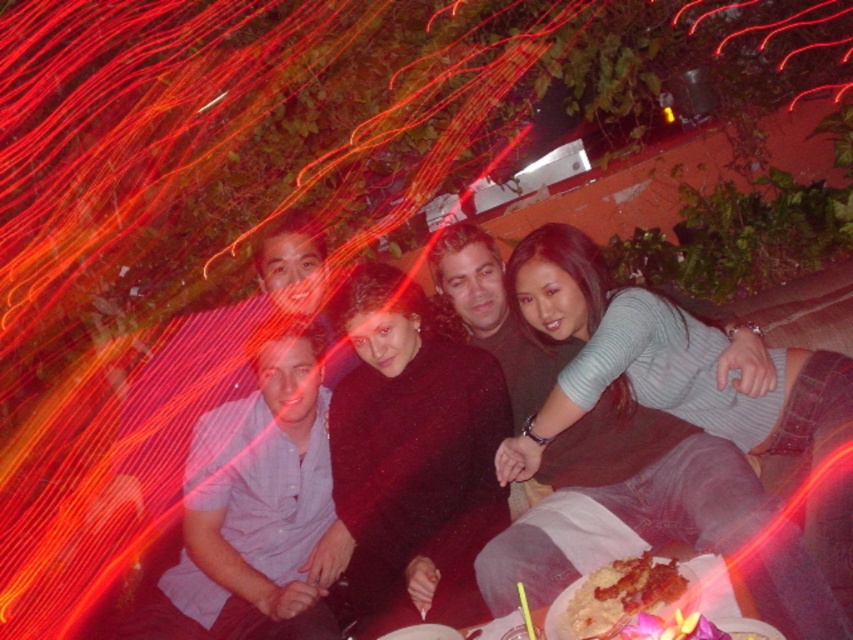
You are a photographer trying to capture a closeup shot of the golden crispy chicken at lower center without including the light blue sweater at center in the frame. Based on their positions, is it possible to do so?

The light blue sweater at center is to the right of golden crispy chicken at lower center. Since the sweater is positioned to the right of the chicken, you can adjust your camera angle to focus solely on the golden crispy chicken at lower center by moving your camera slightly to the left, away from the sweater.

You are taking a photo of the group and want to focus on the person at point (593, 260) and the person at point (633, 568). Which of these two points is closer to the camera?

Point (593, 260) is further to the camera than point (633, 568), so the point (633, 568) is closer to the camera.

You are a food delivery person who just arrived at the party. You need to deliver the golden crispy chicken at lower center to the person wearing the light blue sweater at center. The minimum distance you can approach is 20 inches. Can you reach them without getting too close?

The light blue sweater at center and golden crispy chicken at lower center are 21.82 inches apart. Since the minimum safe distance is 20 inches, you can deliver the chicken within the required distance.